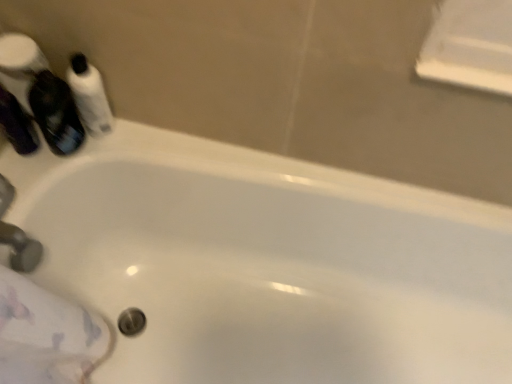
Question: Considering the relative sizes of white glossy mouthwash at upper left, which appears as the 3th mouthwash when viewed from the left, and translucent purple mouthwash at upper left, positioned as the 2th mouthwash in right-to-left order, in the image provided, is white glossy mouthwash at upper left, which appears as the 3th mouthwash when viewed from the left, shorter than translucent purple mouthwash at upper left, positioned as the 2th mouthwash in right-to-left order,?

Choices:
 (A) yes
 (B) no

Answer: (A)

Question: Is white glossy mouthwash at upper left, which appears as the 3th mouthwash when viewed from the left, oriented towards translucent purple mouthwash at upper left, positioned as the 2th mouthwash in right-to-left order?

Choices:
 (A) no
 (B) yes

Answer: (A)

Question: Considering the relative sizes of white glossy mouthwash at upper left, which appears as the 3th mouthwash when viewed from the left, and translucent purple mouthwash at upper left, positioned as the 2th mouthwash in right-to-left order, in the image provided, is white glossy mouthwash at upper left, which appears as the 3th mouthwash when viewed from the left, taller than translucent purple mouthwash at upper left, positioned as the 2th mouthwash in right-to-left order,?

Choices:
 (A) yes
 (B) no

Answer: (B)

Question: Is white glossy mouthwash at upper left, which appears as the 3th mouthwash when viewed from the left, further to camera compared to translucent purple mouthwash at upper left, which is the second mouthwash from left to right?

Choices:
 (A) yes
 (B) no

Answer: (A)

Question: Is white glossy mouthwash at upper left, the first mouthwash viewed from the right, at the right side of translucent purple mouthwash at upper left, which is the second mouthwash from left to right?

Choices:
 (A) yes
 (B) no

Answer: (A)

Question: Considering the relative sizes of white glossy mouthwash at upper left, the first mouthwash viewed from the right, and translucent purple mouthwash at upper left, which is the second mouthwash from left to right, in the image provided, is white glossy mouthwash at upper left, the first mouthwash viewed from the right, smaller than translucent purple mouthwash at upper left, which is the second mouthwash from left to right,?

Choices:
 (A) no
 (B) yes

Answer: (B)

Question: Is matte silver faucet at lower left at the back of matte black bottle at left, the 1th mouthwash viewed from the left?

Choices:
 (A) no
 (B) yes

Answer: (A)

Question: Can you confirm if matte black bottle at left, marked as the 3th mouthwash in a right-to-left arrangement, is positioned to the right of matte silver faucet at lower left?

Choices:
 (A) no
 (B) yes

Answer: (A)

Question: Is matte black bottle at left, the 1th mouthwash viewed from the left, outside of matte silver faucet at lower left?

Choices:
 (A) yes
 (B) no

Answer: (A)

Question: From the image's perspective, is matte black bottle at left, the 1th mouthwash viewed from the left, on matte silver faucet at lower left?

Choices:
 (A) no
 (B) yes

Answer: (B)

Question: Would you say matte black bottle at left, the 1th mouthwash viewed from the left, contains matte silver faucet at lower left?

Choices:
 (A) no
 (B) yes

Answer: (A)

Question: Can you confirm if matte black bottle at left, marked as the 3th mouthwash in a right-to-left arrangement, is taller than matte silver faucet at lower left?

Choices:
 (A) no
 (B) yes

Answer: (B)

Question: Can you confirm if matte silver faucet at lower left is bigger than translucent purple mouthwash at upper left, positioned as the 2th mouthwash in right-to-left order?

Choices:
 (A) no
 (B) yes

Answer: (A)